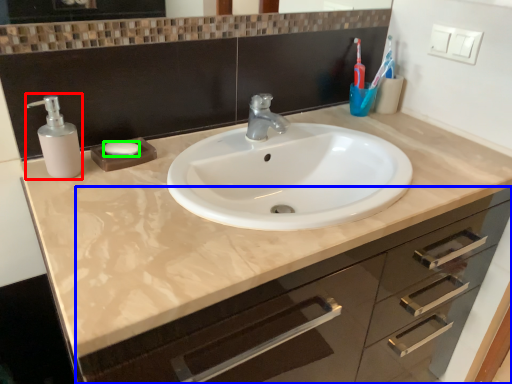
Question: Which object is the closest to the soap dispenser (highlighted by a red box)? Choose among these: bathroom cabinet (highlighted by a blue box) or soap (highlighted by a green box).

Choices:
 (A) bathroom cabinet
 (B) soap

Answer: (B)